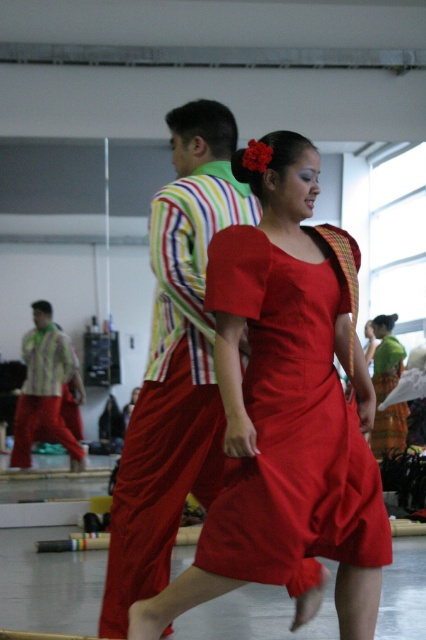
Question: Can you confirm if matte red dress at center is wider than striped cotton shirt at left?

Choices:
 (A) yes
 (B) no

Answer: (A)

Question: Which point is closer to the camera taking this photo?

Choices:
 (A) (181, 157)
 (B) (388, 321)
 (C) (31, 328)
 (D) (282, 268)

Answer: (D)

Question: Does striped cotton shirt at left have a smaller size compared to silky green dress at lower right?

Choices:
 (A) no
 (B) yes

Answer: (B)

Question: Which point is farther to the camera?

Choices:
 (A) (141, 493)
 (B) (63, 419)

Answer: (B)

Question: Can you confirm if matte red dress at center is bigger than silky green dress at lower right?

Choices:
 (A) no
 (B) yes

Answer: (A)

Question: Among these points, which one is farthest from the camera?

Choices:
 (A) (319, 438)
 (B) (396, 353)
 (C) (37, 388)
 (D) (230, 198)

Answer: (B)